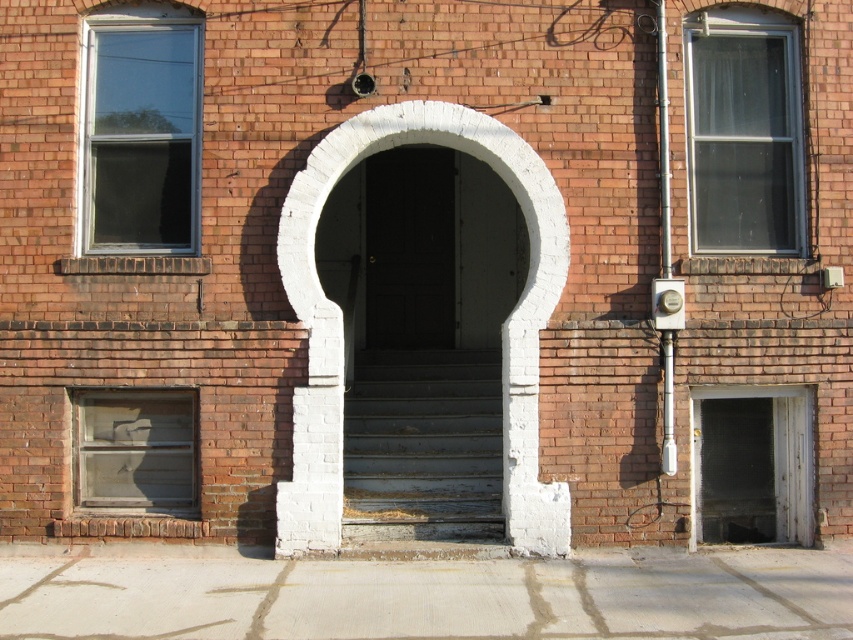
Can you confirm if clear glass window at upper left is wider than clear glass window at lower left?

Incorrect, clear glass window at upper left's width does not surpass clear glass window at lower left's.

Find the location of a particular element. clear glass window at upper left is located at coordinates (140, 136).

Is white mesh screen door at lower right in front of clear glass window at lower left?

No, white mesh screen door at lower right is further to the viewer.

Between point (695, 460) and point (169, 422), which one is positioned in front?

Positioned in front is point (169, 422).

This screenshot has width=853, height=640. Describe the element at coordinates (752, 465) in the screenshot. I see `white mesh screen door at lower right` at that location.

You are a GUI agent. You are given a task and a screenshot of the screen. Output one action in this format:
    pyautogui.click(x=<x>, y=<y>)
    Task: Click on the white mesh screen door at lower right
    The image size is (853, 640).
    Given the screenshot: What is the action you would take?
    pyautogui.click(x=752, y=465)

Can you confirm if clear glass window at upper left is positioned below clear glass window at upper right?

Yes.

Is point (122, 177) farther from viewer compared to point (730, 136)?

That is False.

The width and height of the screenshot is (853, 640). I want to click on clear glass window at upper left, so click(140, 136).